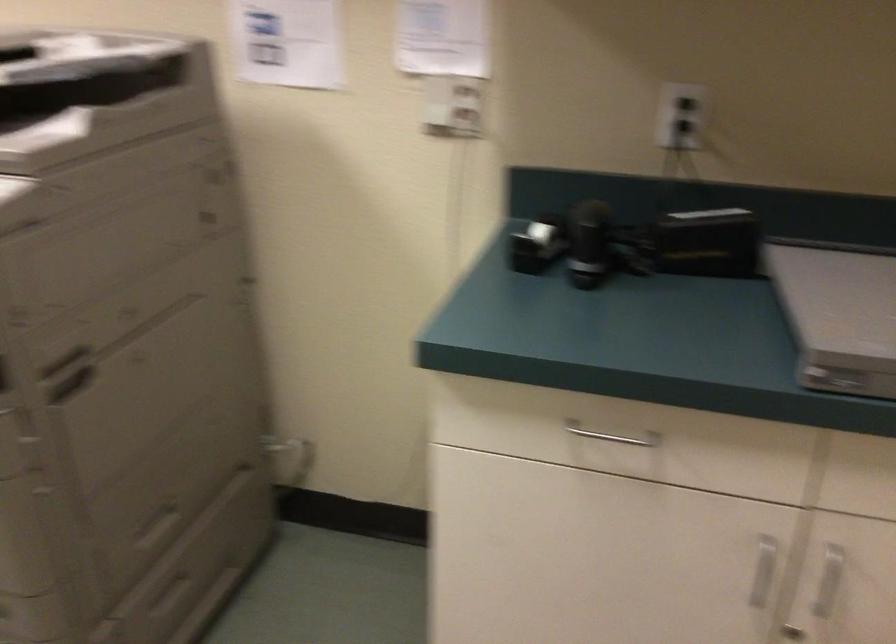
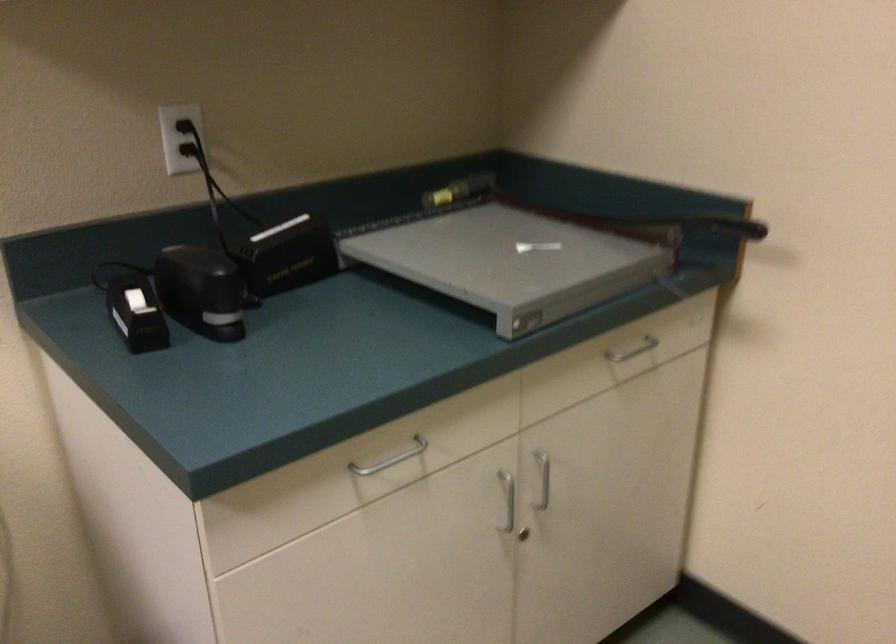
Locate, in the second image, the point that corresponds to (x=631, y=442) in the first image.

(391, 459)